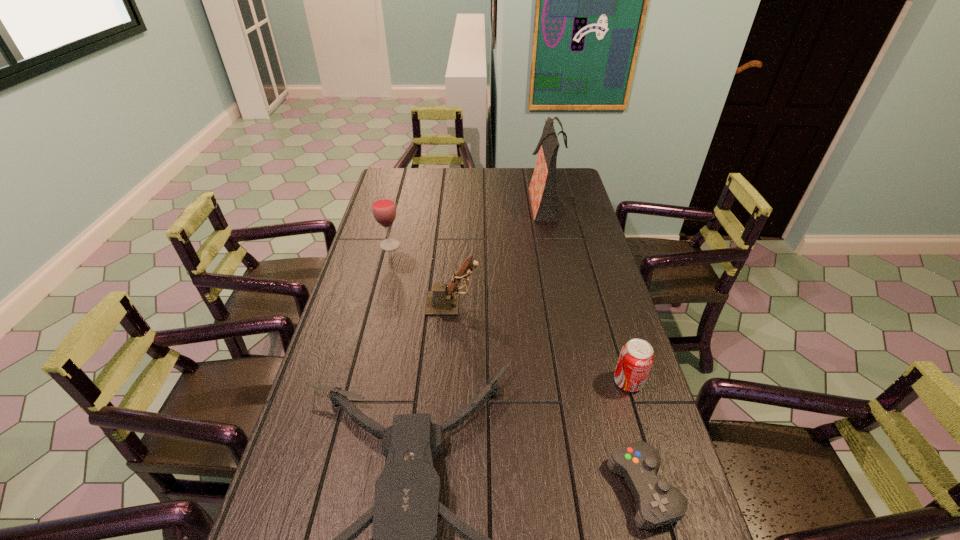
This screenshot has width=960, height=540. I want to click on vacant space positioned on the front of the fifth nearest object, so click(x=383, y=271).

Where is `vacant area situated on the front of the soda`? The width and height of the screenshot is (960, 540). vacant area situated on the front of the soda is located at coordinates (649, 450).

Find the location of a particular element. The width and height of the screenshot is (960, 540). free space located on the back of the shortest object is located at coordinates (600, 329).

Identify the location of object present at the far edge. (542, 189).

Locate an element on the screen. Image resolution: width=960 pixels, height=540 pixels. object that is at the left edge is located at coordinates (384, 209).

This screenshot has height=540, width=960. Find the location of `shopping bag at the right edge`. shopping bag at the right edge is located at coordinates (542, 189).

At what (x,y) coordinates should I click in order to perform the action: click on soda at the right edge. Please return your answer as a coordinate pair (x, y). The image size is (960, 540). Looking at the image, I should click on (636, 358).

Find the location of `control at the right edge`. control at the right edge is located at coordinates (658, 503).

The width and height of the screenshot is (960, 540). I want to click on object located at the far right corner, so click(x=542, y=189).

The image size is (960, 540). In the image, there is a desktop. What are the coordinates of `vacant space at the far edge` in the screenshot? It's located at (443, 192).